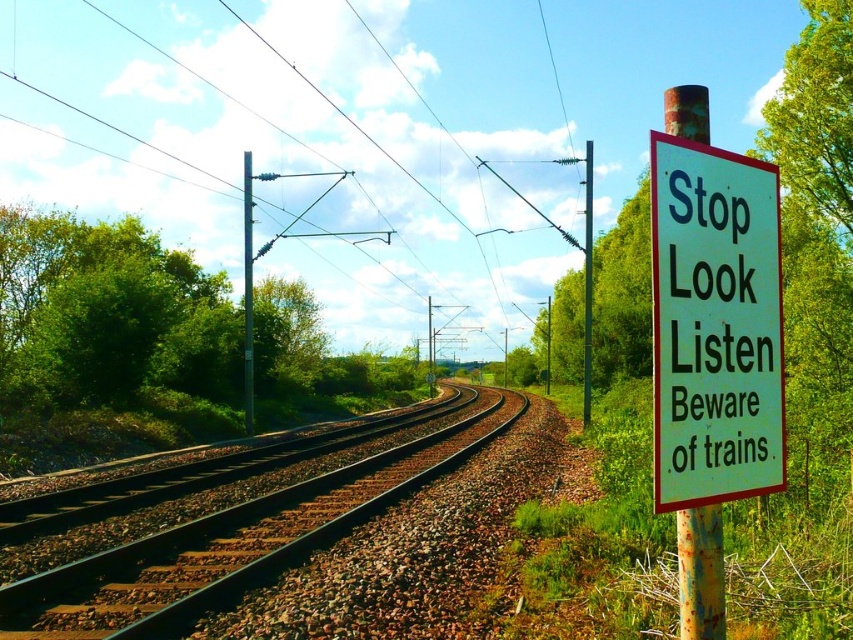
Based on the photo, is metallic wires at upper center taller than rusty metal signpost at right?

Correct, metallic wires at upper center is much taller as rusty metal signpost at right.

The height and width of the screenshot is (640, 853). Describe the element at coordinates (321, 129) in the screenshot. I see `metallic wires at upper center` at that location.

Is point (492, 48) farther from viewer compared to point (704, 531)?

Yes, point (492, 48) is behind point (704, 531).

Where is `metallic wires at upper center`? The width and height of the screenshot is (853, 640). metallic wires at upper center is located at coordinates (321, 129).

From the picture: Does metallic wires at upper center have a greater height compared to metallic pole at center?

Yes.

Which is in front, point (183, 218) or point (247, 432)?

Positioned in front is point (247, 432).

The image size is (853, 640). What do you see at coordinates (321, 129) in the screenshot?
I see `metallic wires at upper center` at bounding box center [321, 129].

Locate an element on the screen. The width and height of the screenshot is (853, 640). metallic wires at upper center is located at coordinates (321, 129).

Who is lower down, rusty metal signpost at right or rusty metal pole at right?

rusty metal signpost at right is lower down.

Is point (704, 566) farther from viewer compared to point (585, 292)?

No, it is in front of (585, 292).

This screenshot has width=853, height=640. Identify the location of rusty metal signpost at right. pos(700,572).